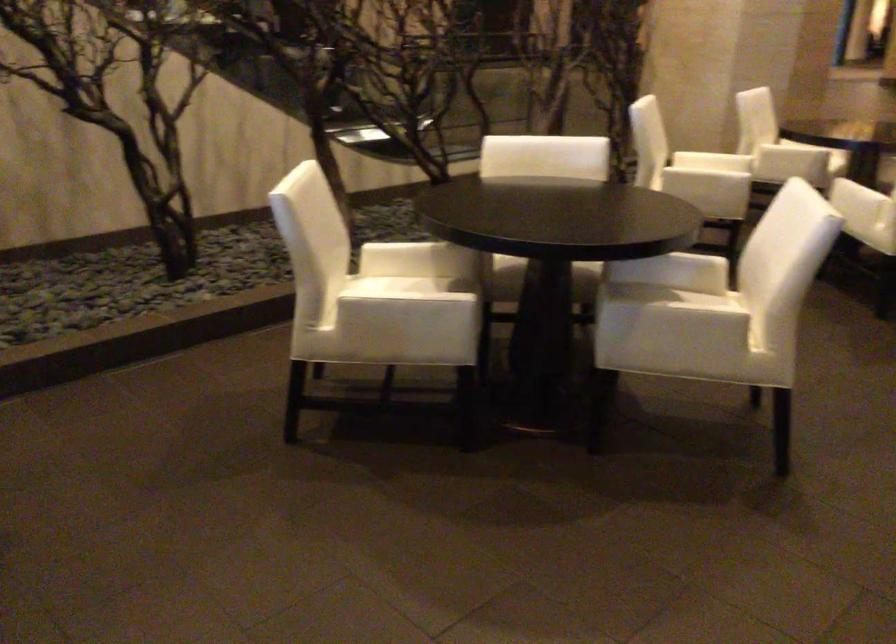
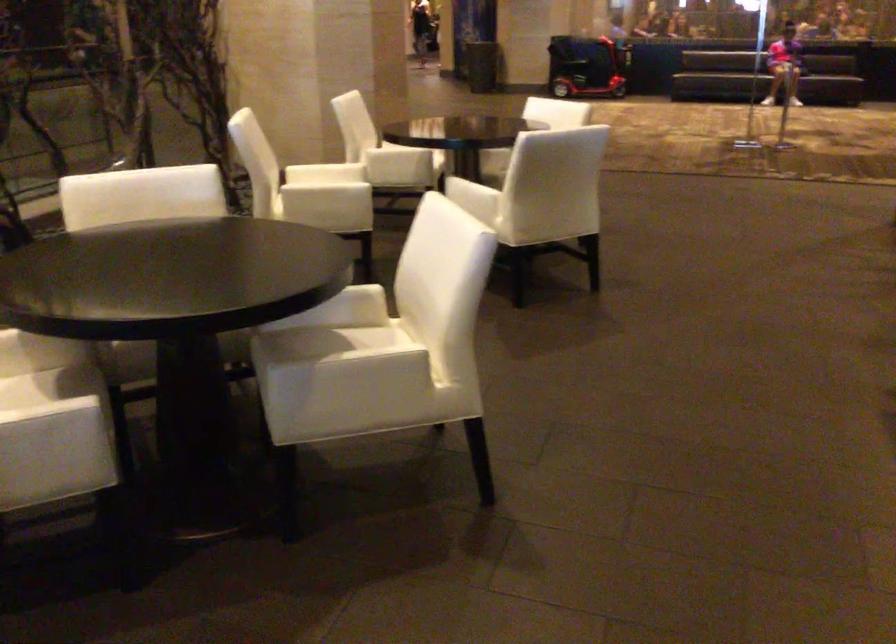
In the second image, find the point that corresponds to [720,174] in the first image.

(325, 199)